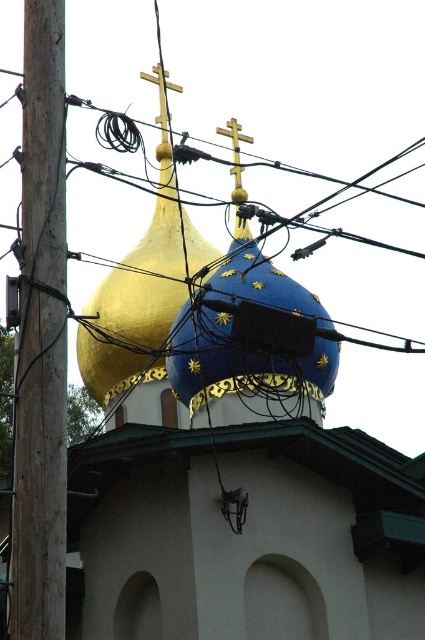
Which is behind, point (54, 538) or point (235, 170)?

Positioned behind is point (235, 170).

Which is behind, point (34, 294) or point (229, 125)?

The point (229, 125) is behind.

Locate an element on the screen. Image resolution: width=425 pixels, height=640 pixels. wooden utility pole at left is located at coordinates (40, 339).

Is point (158, 330) farther from camera compared to point (235, 184)?

No, (158, 330) is closer to viewer.

Does gold metallic dome at upper center have a greater height compared to gold polished metal cross at center?

Correct, gold metallic dome at upper center is much taller as gold polished metal cross at center.

The image size is (425, 640). What do you see at coordinates (141, 296) in the screenshot? I see `gold metallic dome at upper center` at bounding box center [141, 296].

Where is `gold metallic dome at upper center`? gold metallic dome at upper center is located at coordinates (141, 296).

Looking at this image, does blue glossy dome at center have a lesser height compared to gold metallic cross at upper center?

Incorrect, blue glossy dome at center's height does not fall short of gold metallic cross at upper center's.

From the picture: Is blue glossy dome at center below gold metallic cross at upper center?

Correct, blue glossy dome at center is located below gold metallic cross at upper center.

What do you see at coordinates (243, 368) in the screenshot?
I see `blue glossy dome at center` at bounding box center [243, 368].

Identify the location of blue glossy dome at center. tap(243, 368).